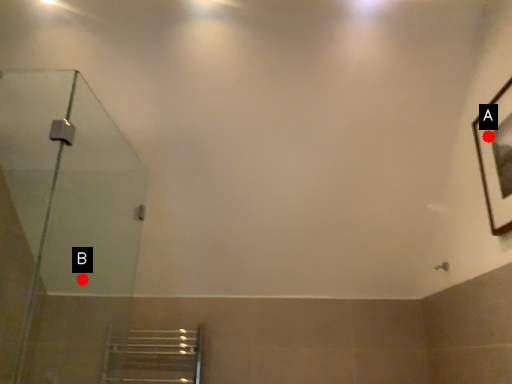
Question: Two points are circled on the image, labeled by A and B beside each circle. Which point is further to the camera?

Choices:
 (A) A is further
 (B) B is further

Answer: (B)